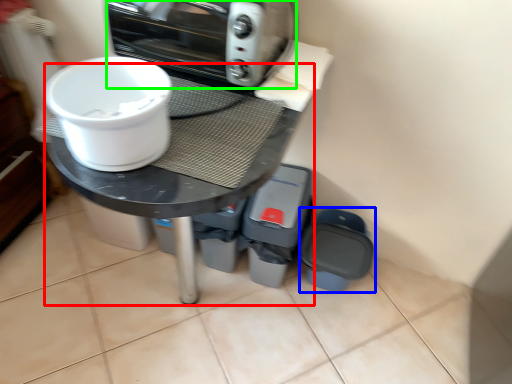
Question: Which object is the farthest from round table (highlighted by a red box)? Choose among these: appliance (highlighted by a blue box) or kitchen appliance (highlighted by a green box).

Choices:
 (A) appliance
 (B) kitchen appliance

Answer: (A)